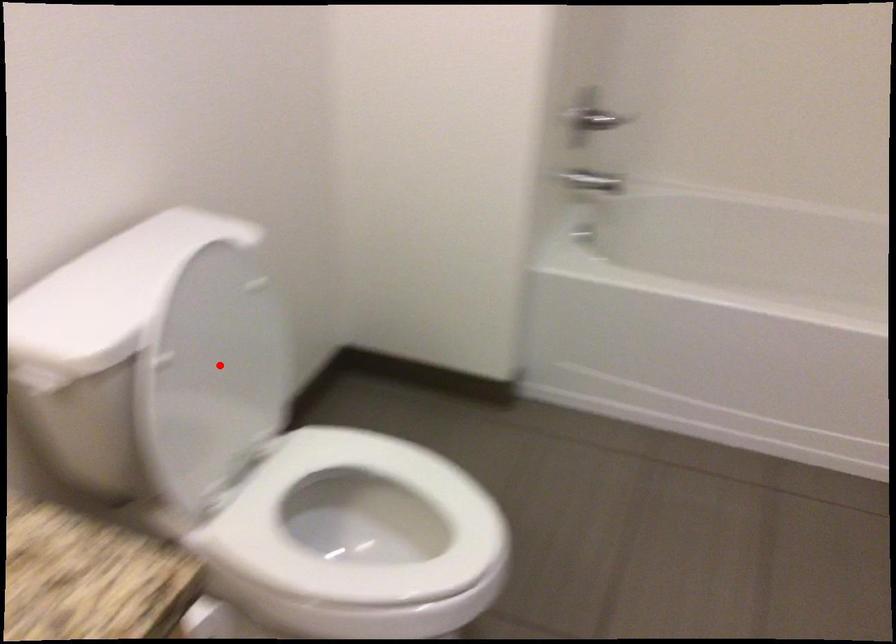
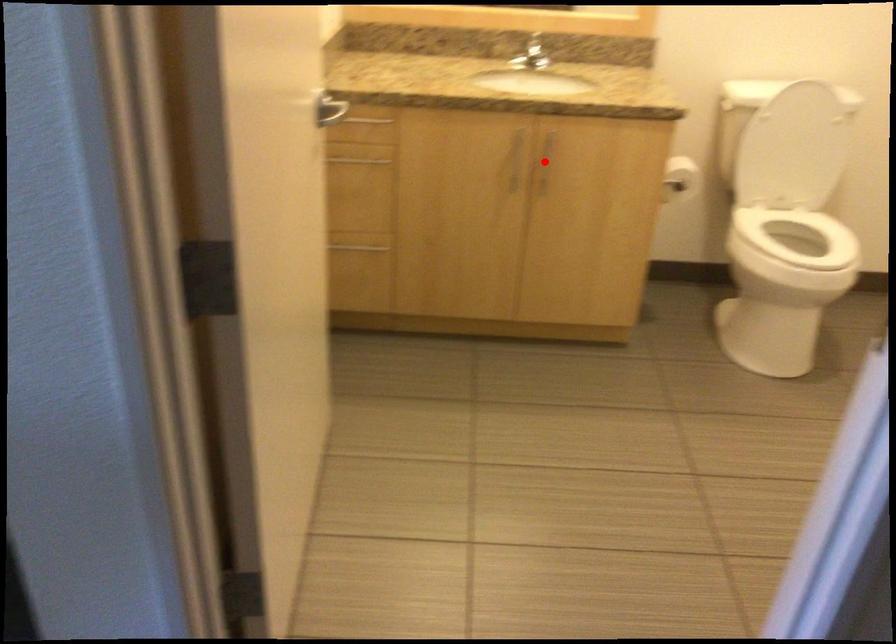
I am providing you with two images of the same scene from different viewpoints. A red point is marked on the first image and another point is marked on the second image. Is the marked point in image1 the same physical position as the marked point in image2?

No